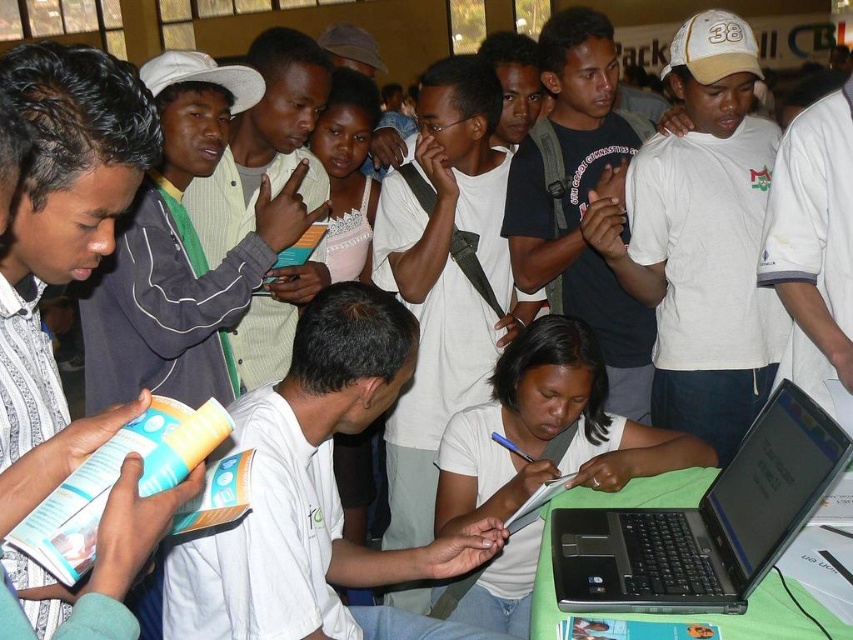
You are standing at the center of the image and want to place a new object at point [704,524]. What object is already there?

The black plastic laptop at lower right is located at point [704,524].

You are a delivery robot with a package that needs to be placed between the black plastic laptop at lower right and the white matte shirt at center. The package measures 12 inches in length. Will there be enough space to place the package between them?

The distance between the black plastic laptop at lower right and the white matte shirt at center is 15.38 inches. Since the package is 12 inches long, there is sufficient space to place it between them.

You are a photographer setting up for a group photo. You need to ensure that the black plastic laptop at lower right and the white matte shirt at center are both visible in the frame. Considering their heights, which object might require you to adjust your camera angle to avoid blocking the view of the other?

The black plastic laptop at lower right has a lesser height compared to the white matte shirt at center. Therefore, you might need to lower the camera angle to ensure the laptop is visible without being blocked by the shirt or other elements.